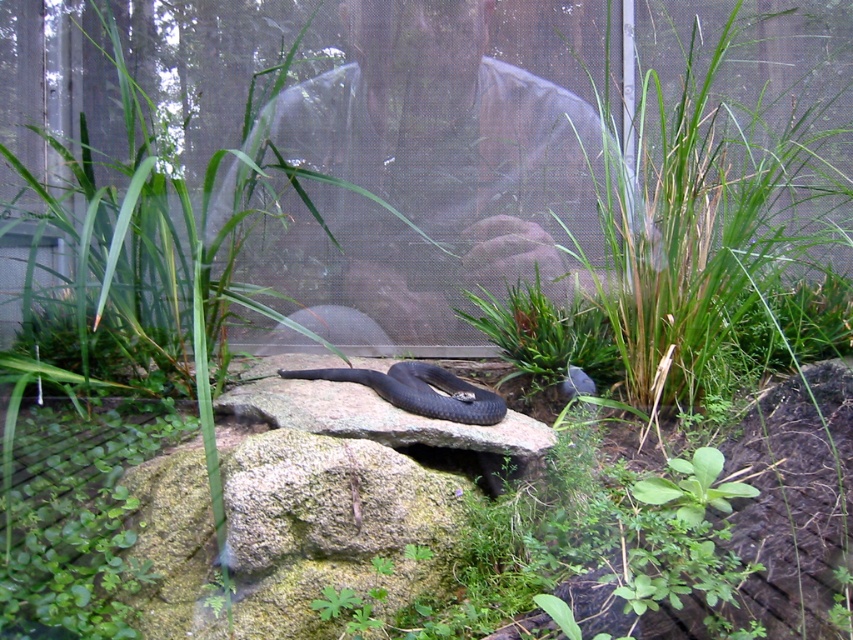
Question: Is green grass at center smaller than shiny black snake at center?

Choices:
 (A) yes
 (B) no

Answer: (B)

Question: Which point is closer to the camera?

Choices:
 (A) green grass at center
 (B) shiny black snake at center

Answer: (B)

Question: Is green grass at center to the right of shiny black snake at center from the viewer's perspective?

Choices:
 (A) yes
 (B) no

Answer: (A)

Question: Can you confirm if green grass at center is wider than shiny black snake at center?

Choices:
 (A) no
 (B) yes

Answer: (B)

Question: Among these objects, which one is farthest from the camera?

Choices:
 (A) green grass at center
 (B) shiny black snake at center

Answer: (A)